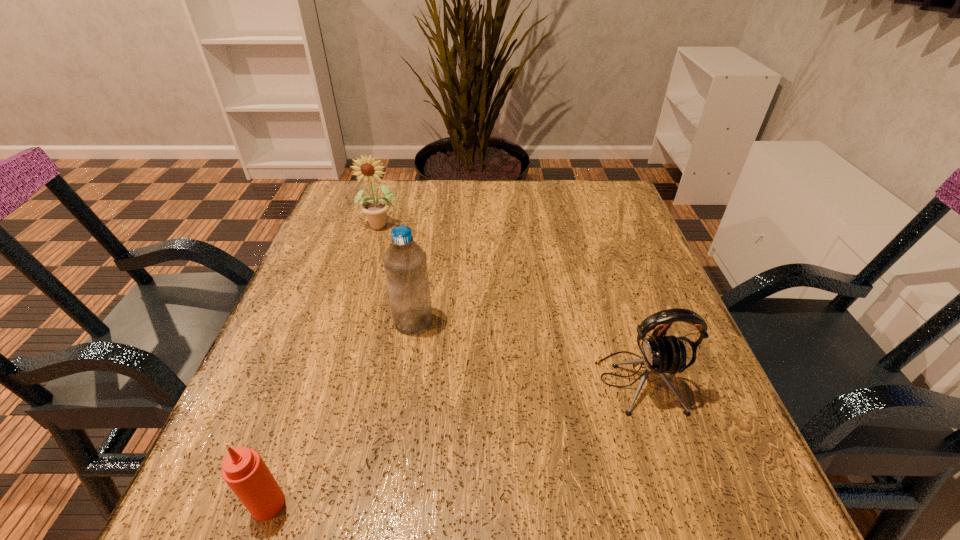
Where is `vacant area at the left edge of the desktop`? This screenshot has width=960, height=540. vacant area at the left edge of the desktop is located at coordinates (335, 318).

Where is `vacant region at the right edge of the desktop`? vacant region at the right edge of the desktop is located at coordinates (628, 374).

Find the location of a particular element. This screenshot has height=540, width=960. free space at the far left corner of the desktop is located at coordinates (339, 191).

The height and width of the screenshot is (540, 960). In the image, there is a desktop. In order to click on vacant space at the near left corner in this screenshot , I will do `click(211, 529)`.

What are the coordinates of `vacant area at the far right corner` in the screenshot? It's located at (604, 208).

Locate an element on the screen. This screenshot has height=540, width=960. vacant area at the near right corner is located at coordinates [x=654, y=483].

Where is `vacant area between the Tabasco sauce and the second object from right to left`? This screenshot has height=540, width=960. vacant area between the Tabasco sauce and the second object from right to left is located at coordinates (341, 413).

Image resolution: width=960 pixels, height=540 pixels. Find the location of `free point between the shortest object and the sunflower`. free point between the shortest object and the sunflower is located at coordinates (325, 364).

Where is `free space that is in between the third farthest object and the Tabasco sauce`? The width and height of the screenshot is (960, 540). free space that is in between the third farthest object and the Tabasco sauce is located at coordinates (453, 443).

At what (x,y) coordinates should I click in order to perform the action: click on empty space that is in between the shortest object and the second nearest object. Please return your answer as a coordinate pair (x, y). Looking at the image, I should click on (453, 443).